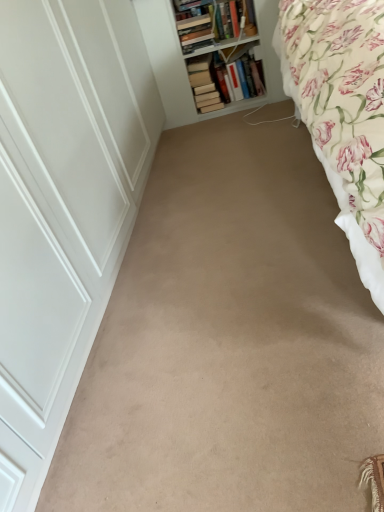
The image size is (384, 512). I want to click on empty space that is ontop of beige carpet at center (from a real-world perspective), so click(212, 234).